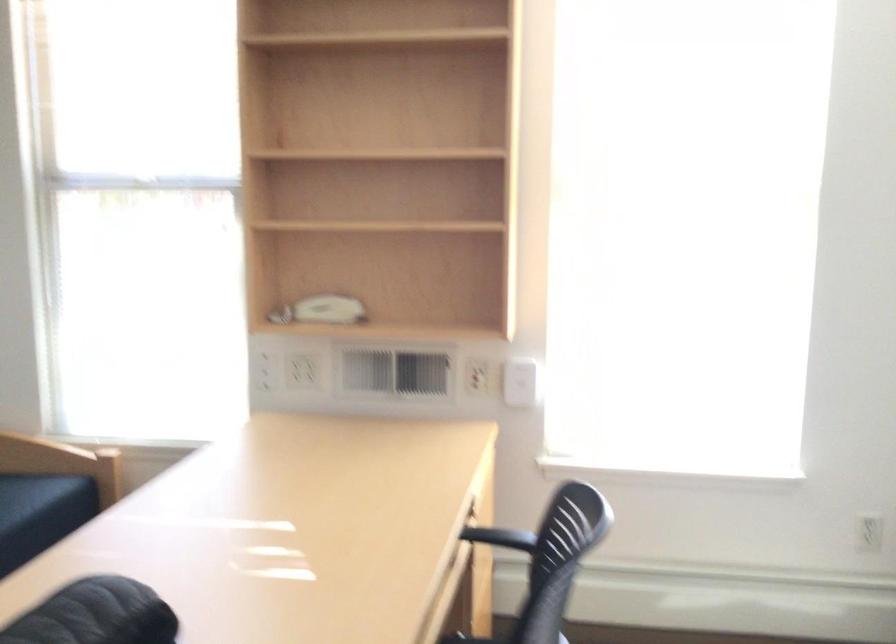
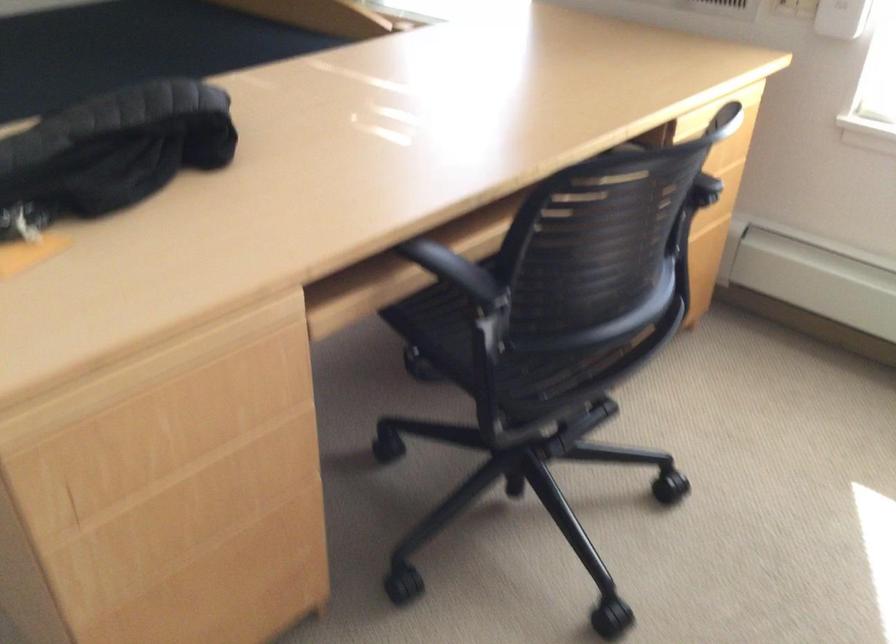
Based on the continuous images, in which direction is the camera rotating?

The rotation direction of the camera is left-down.